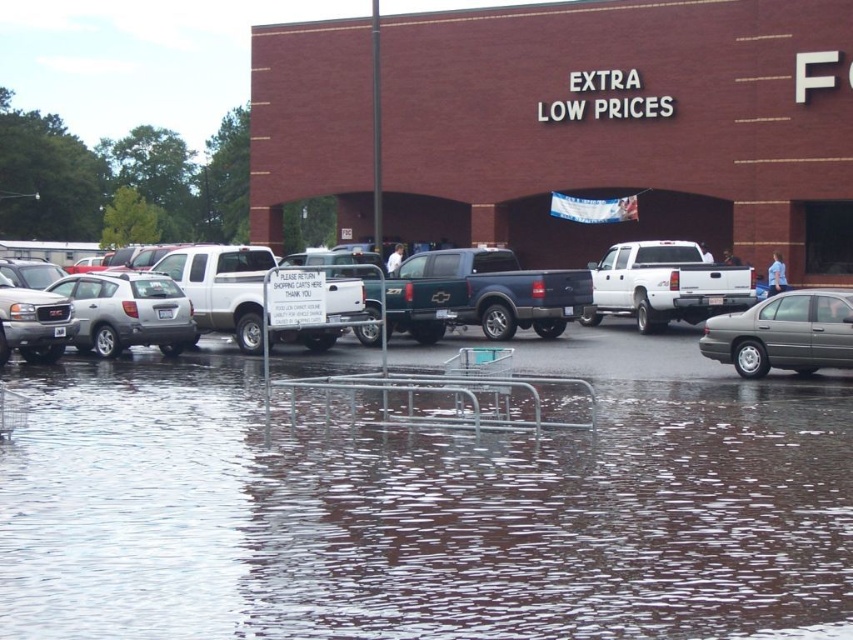
Question: Is brown brick building at upper center below metallic gray sedan at right?

Choices:
 (A) no
 (B) yes

Answer: (A)

Question: Can you confirm if metallic gray sedan at right is smaller than matte silver suv at left?

Choices:
 (A) no
 (B) yes

Answer: (A)

Question: Is clear water at lower center bigger than white matte truck at center?

Choices:
 (A) no
 (B) yes

Answer: (B)

Question: Which is nearer to the matte silver suv at left?

Choices:
 (A) brown brick building at upper center
 (B) clear water at lower center

Answer: (B)

Question: Among these points, which one is nearest to the camera?

Choices:
 (A) (70, 332)
 (B) (321, 131)
 (C) (836, 579)
 (D) (749, 278)

Answer: (C)

Question: Which point is closer to the camera?

Choices:
 (A) brown brick building at upper center
 (B) satin silver suv at left

Answer: (B)